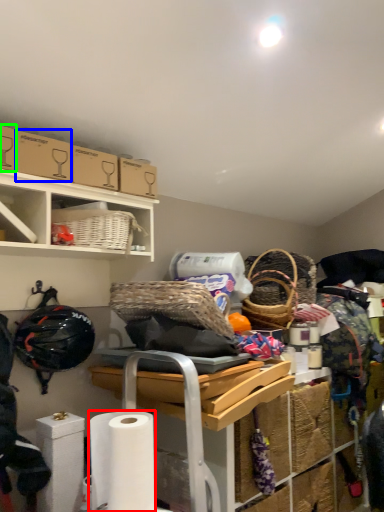
Question: Estimate the real-world distances between objects in this image. Which object is farther from toilet paper (highlighted by a red box), cardboard box (highlighted by a blue box) or storage box (highlighted by a green box)?

Choices:
 (A) cardboard box
 (B) storage box

Answer: (B)